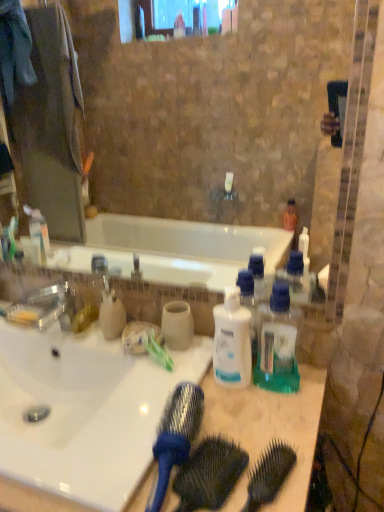
Where is `vacant area that is in front of white plastic bottle at center, the 2th bottle from the right`? The image size is (384, 512). vacant area that is in front of white plastic bottle at center, the 2th bottle from the right is located at coordinates (246, 425).